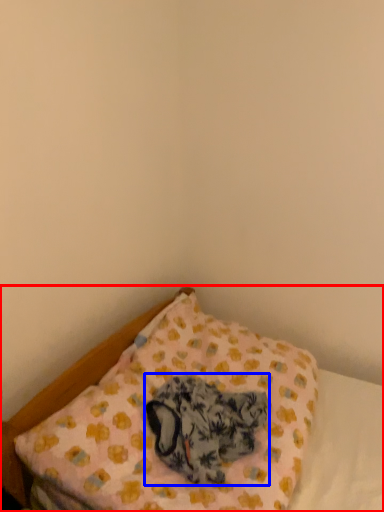
Question: Among these objects, which one is farthest to the camera, bed (highlighted by a red box) or animal (highlighted by a blue box)?

Choices:
 (A) bed
 (B) animal

Answer: (B)